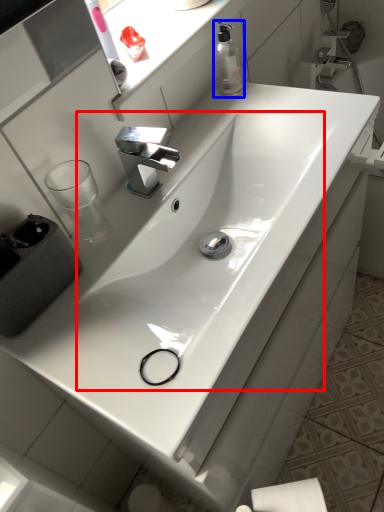
Question: Which of the following is the farthest to the observer, sink (highlighted by a red box) or soap dispenser (highlighted by a blue box)?

Choices:
 (A) sink
 (B) soap dispenser

Answer: (B)